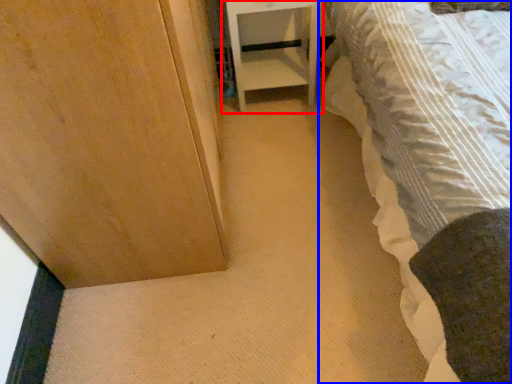
Question: Among these objects, which one is farthest to the camera, furniture (highlighted by a red box) or bed (highlighted by a blue box)?

Choices:
 (A) furniture
 (B) bed

Answer: (A)